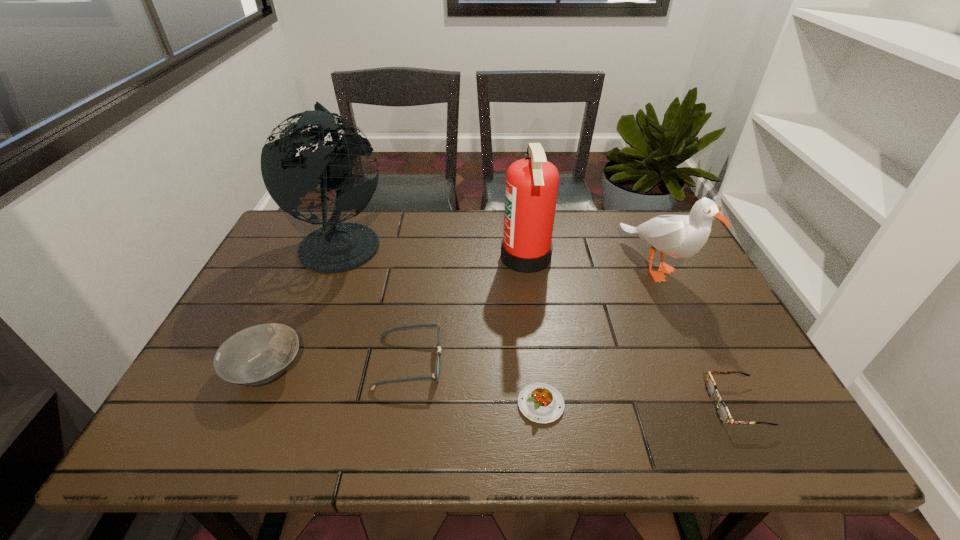
Find the location of a particular element. This screenshot has width=960, height=540. free spot between the fire extinguisher and the gull is located at coordinates (590, 262).

This screenshot has width=960, height=540. Find the location of `free space between the third tallest object and the pudding`. free space between the third tallest object and the pudding is located at coordinates (598, 335).

Identify the location of empty location between the fifth tallest object and the shorter spectacles. This screenshot has height=540, width=960. (572, 383).

Image resolution: width=960 pixels, height=540 pixels. Identify the location of vacant area that lies between the pudding and the fire extinguisher. (534, 331).

Locate an element on the screen. The height and width of the screenshot is (540, 960). vacant space in between the pudding and the bowl is located at coordinates (403, 387).

Image resolution: width=960 pixels, height=540 pixels. In order to click on free space between the bowl and the fifth shortest object in this screenshot , I will do `click(461, 318)`.

Identify the location of free space that is in between the gull and the right spectacles. The height and width of the screenshot is (540, 960). (696, 335).

This screenshot has height=540, width=960. What are the coordinates of `object that is the second nearest to the pudding` in the screenshot? It's located at (723, 413).

Where is `object that can be found as the closest to the globe`? This screenshot has height=540, width=960. object that can be found as the closest to the globe is located at coordinates (436, 373).

Where is `free space in the image that satisfies the following two spatial constraints: 1. at the beak of the gull; 2. on the face of the left spectacles`? Image resolution: width=960 pixels, height=540 pixels. free space in the image that satisfies the following two spatial constraints: 1. at the beak of the gull; 2. on the face of the left spectacles is located at coordinates tap(701, 362).